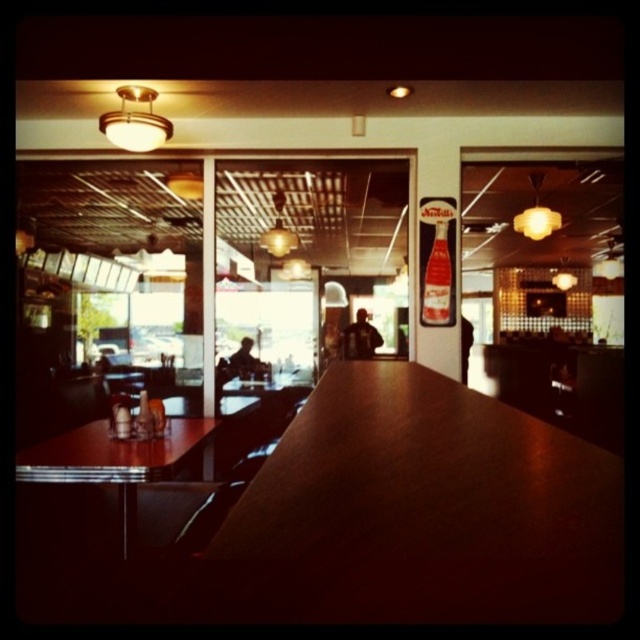
You are taking a photo of the diner table and want to ensure both the condiment holder and the salt shaker are in focus. Given that the condiment holder is at point (61, 477) and the salt shaker is at point (148, 416), which object should you focus on to capture both clearly?

You should focus on the condiment holder at point (61, 477) because it is closer to the camera than the salt shaker at point (148, 416). By focusing on the closer object, the depth of field may extend to include the farther object in acceptable focus.

You are standing in the diner and want to place a small vase on the wooden table at center. Given that the diner is 10 meters long and the table is positioned at coordinates point (420, 513), can you estimate whether the table is closer to the entrance or the back wall?

The coordinates point (420, 513) for the wooden table at center indicate its position within the diner. Since the diner is 10 meters long, the table is closer to the back wall than the entrance based on its coordinate positioning.

You are a delivery person trying to place a large box on the wooden table at left and the matte plastic bottle at center. Which surface has enough space to accommodate the box?

The wooden table at left has a greater width than the matte plastic bottle at center, so the wooden table at left can accommodate the box.